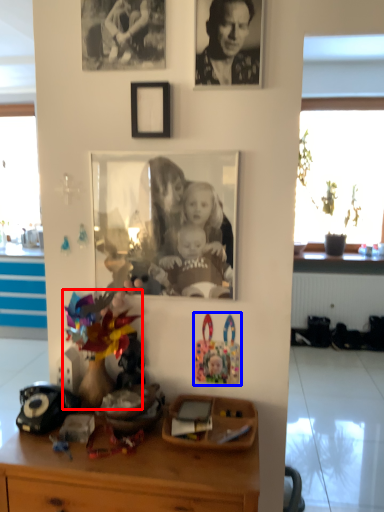
Question: Which object is closer to the camera taking this photo, toy (highlighted by a red box) or toy (highlighted by a blue box)?

Choices:
 (A) toy
 (B) toy

Answer: (A)